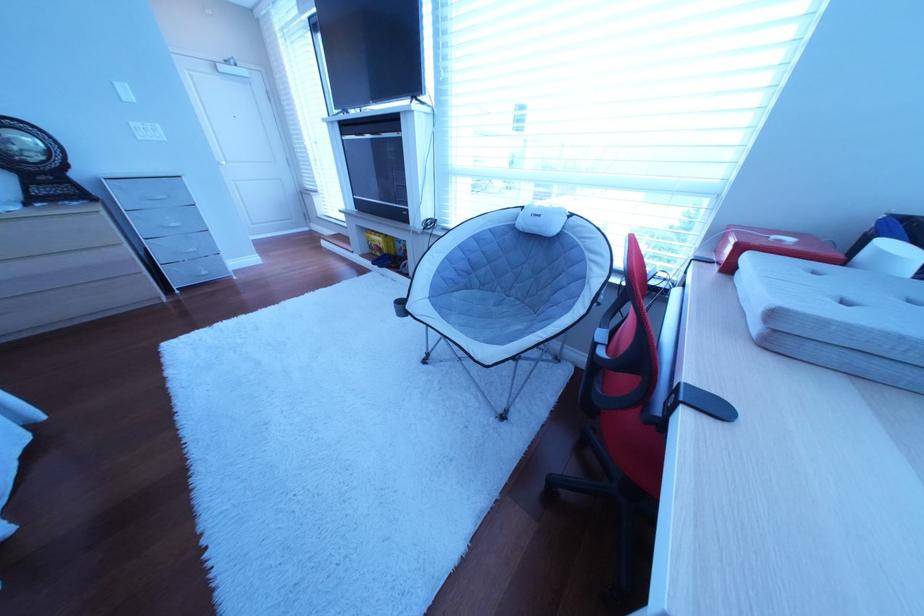
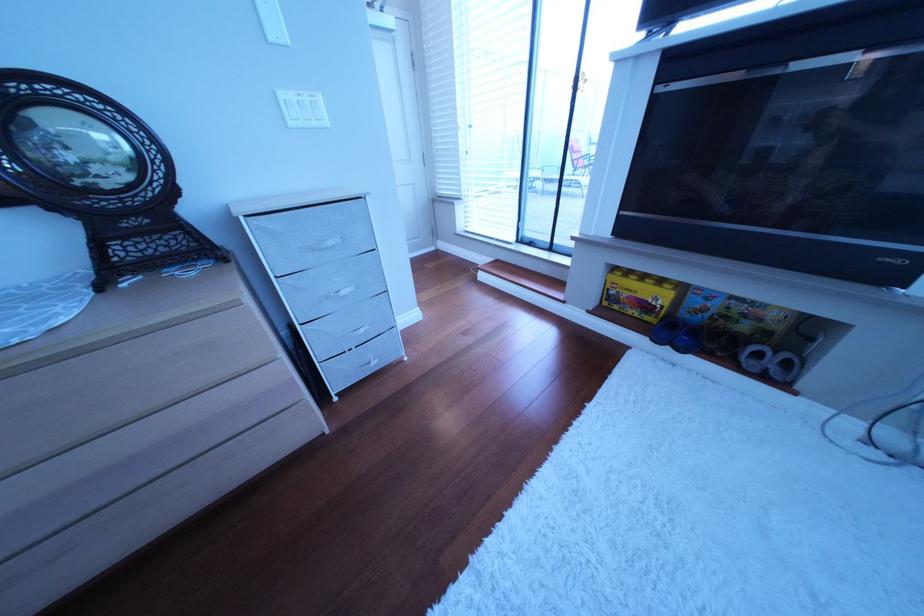
Locate, in the second image, the point that corresponds to pixel 388 246 in the first image.

(640, 296)